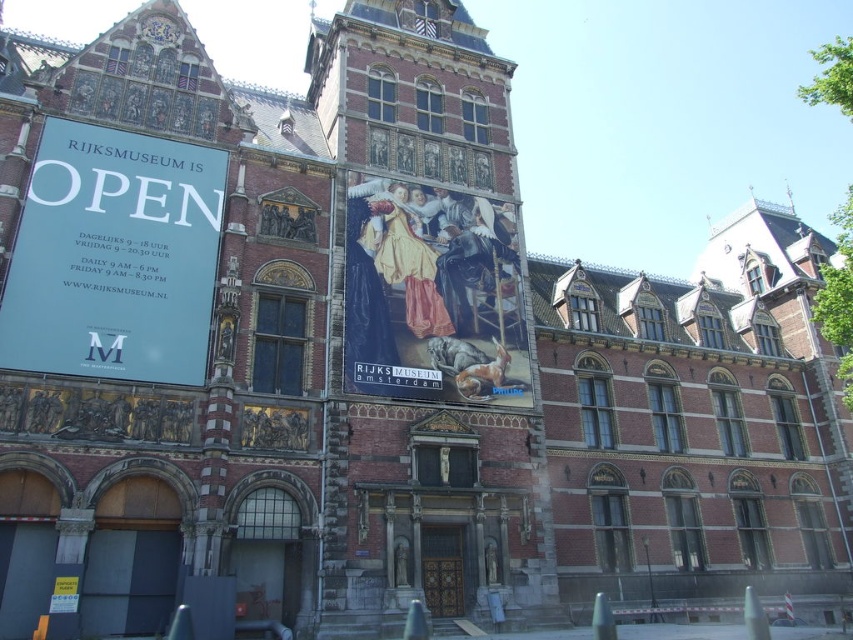
Question: Can you confirm if white paper sign at left is positioned above gold metallic clock at upper center?

Choices:
 (A) no
 (B) yes

Answer: (A)

Question: Which point appears closest to the camera in this image?

Choices:
 (A) (167, 28)
 (B) (39, 163)

Answer: (B)

Question: Which point is closer to the camera?

Choices:
 (A) white paper sign at left
 (B) matte oil painting at center

Answer: (A)

Question: Is matte oil painting at center to the left of gold metallic clock at upper center from the viewer's perspective?

Choices:
 (A) no
 (B) yes

Answer: (A)

Question: Which object is positioned closest to the white paper sign at left?

Choices:
 (A) gold metallic clock at upper center
 (B) matte oil painting at center

Answer: (B)

Question: Can you confirm if white paper sign at left is thinner than matte oil painting at center?

Choices:
 (A) yes
 (B) no

Answer: (A)